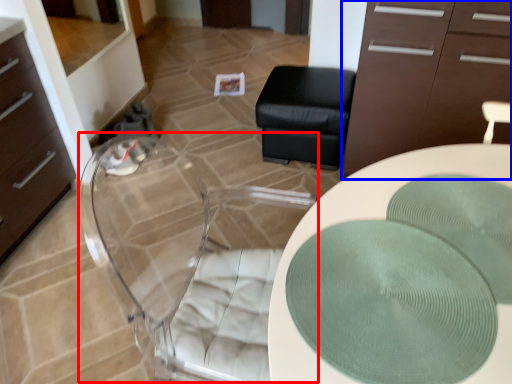
Question: Which object appears farthest to the camera in this image, swivel chair (highlighted by a red box) or cabinetry (highlighted by a blue box)?

Choices:
 (A) swivel chair
 (B) cabinetry

Answer: (B)